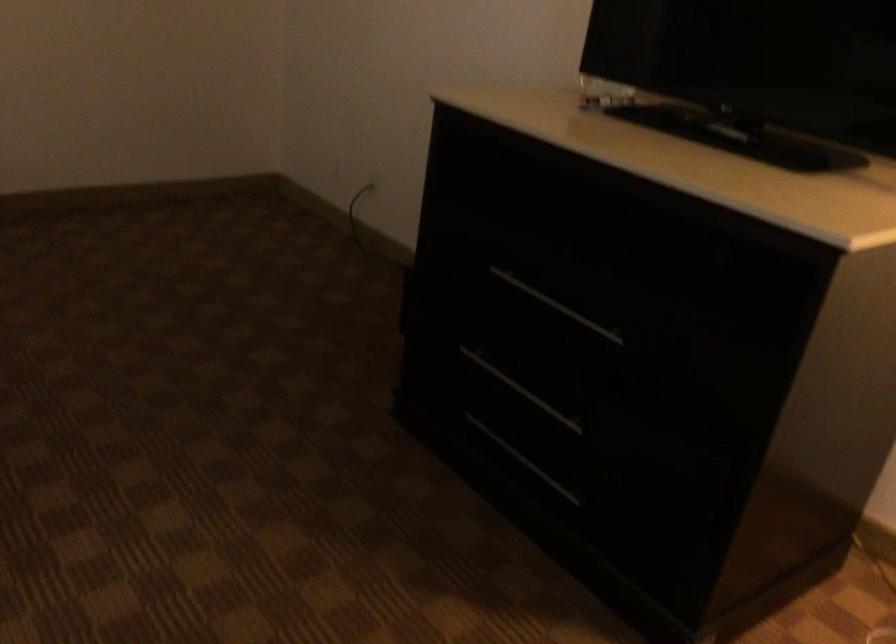
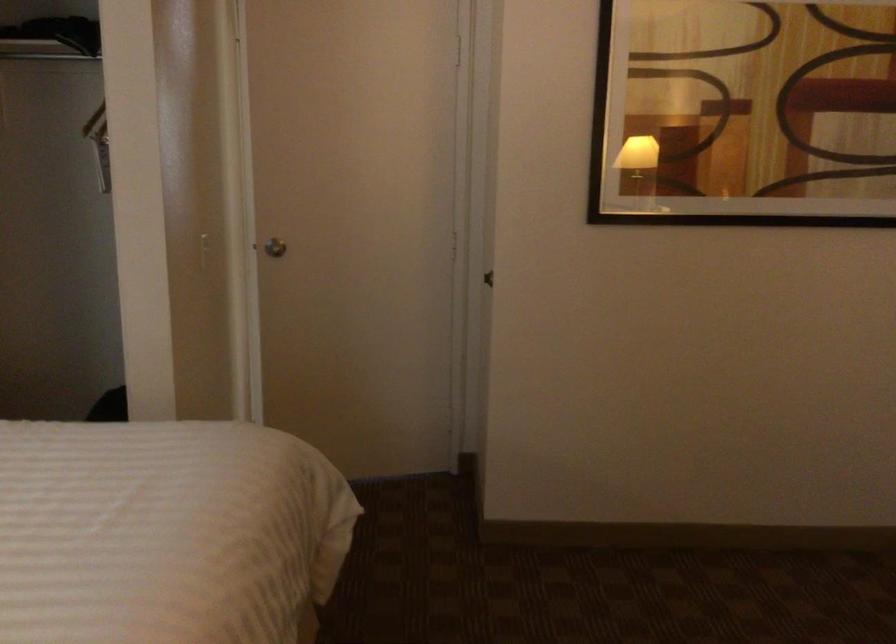
Question: The first image is from the beginning of the video and the second image is from the end. How did the camera likely rotate when shooting the video?

Choices:
 (A) Left
 (B) Right
 (C) Up
 (D) Down

Answer: (A)